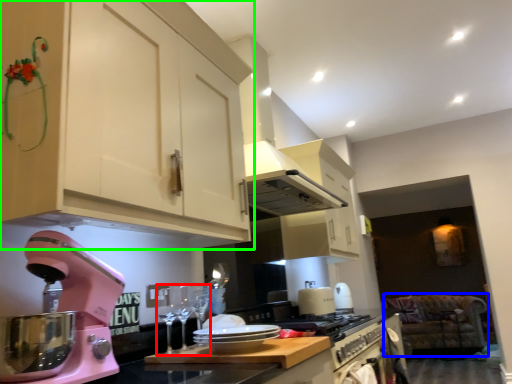
Question: Estimate the real-world distances between objects in this image. Which object is closer to wine glass (highlighted by a red box), sit (highlighted by a blue box) or cabinetry (highlighted by a green box)?

Choices:
 (A) sit
 (B) cabinetry

Answer: (B)